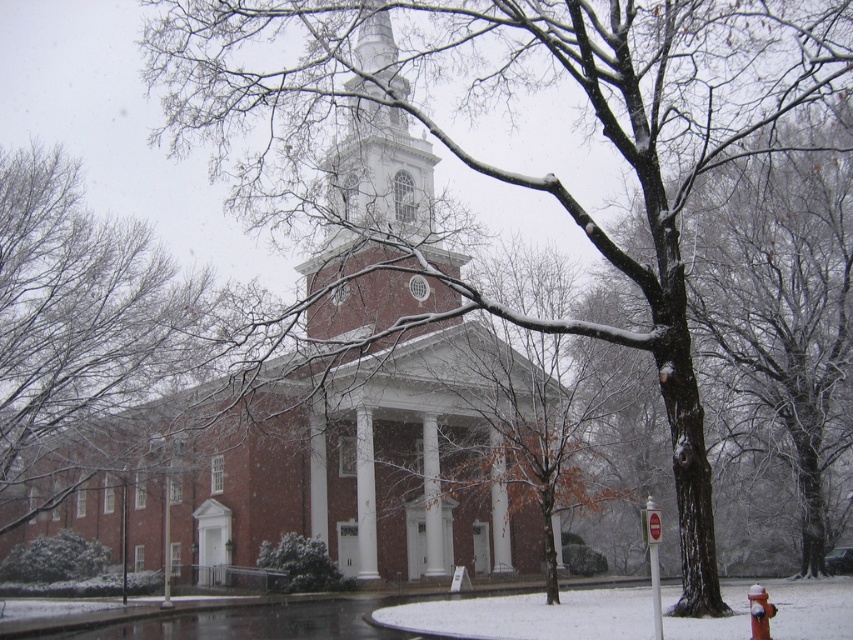
Question: Based on their relative distances, which object is farther from the brick building at center?

Choices:
 (A) white textured steeple at center
 (B) snow-covered fire hydrant at lower right

Answer: (B)

Question: Is brick building at center behind snow-covered fire hydrant at lower right?

Choices:
 (A) yes
 (B) no

Answer: (A)

Question: Does brick building at center appear over white textured steeple at center?

Choices:
 (A) no
 (B) yes

Answer: (A)

Question: Which object is the farthest from the brick building at center?

Choices:
 (A) white textured steeple at center
 (B) snow-covered fire hydrant at lower right

Answer: (B)

Question: Which point is closer to the camera taking this photo?

Choices:
 (A) (526, 534)
 (B) (426, 195)

Answer: (A)

Question: Is brick building at center in front of snow-covered fire hydrant at lower right?

Choices:
 (A) yes
 (B) no

Answer: (B)